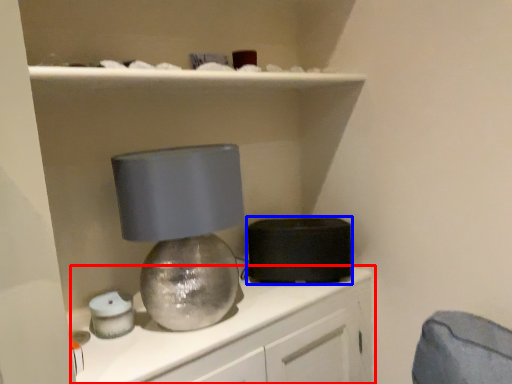
Question: Among these objects, which one is nearest to the camera, cabinetry (highlighted by a red box) or appliance (highlighted by a blue box)?

Choices:
 (A) cabinetry
 (B) appliance

Answer: (A)